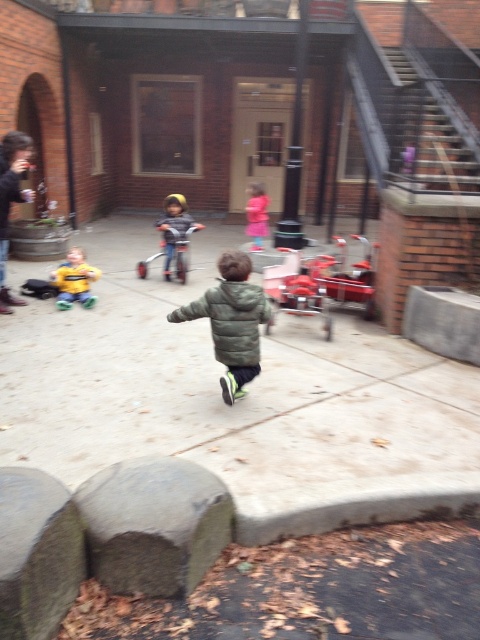
Question: Which point is farther to the camera?

Choices:
 (A) matte blue helmet at center
 (B) metallic silver tricycle at center

Answer: (A)

Question: Is yellow fabric jacket at lower left to the left of matte blue helmet at center from the viewer's perspective?

Choices:
 (A) no
 (B) yes

Answer: (B)

Question: Which object is the closest to the gray concrete pavement at center?

Choices:
 (A) metallic red fire truck at center
 (B) pink fabric toddler at center
 (C) green fuzzy jacket at center
 (D) matte blue helmet at center

Answer: (D)

Question: In this image, where is gray concrete pavement at center located relative to pink fabric toddler at center?

Choices:
 (A) right
 (B) left

Answer: (B)

Question: Does gray concrete pavement at center appear under green fuzzy jacket at center?

Choices:
 (A) no
 (B) yes

Answer: (A)

Question: Which point is closer to the camera taking this photo?

Choices:
 (A) (184, 198)
 (B) (248, 228)
 (C) (72, 275)

Answer: (C)